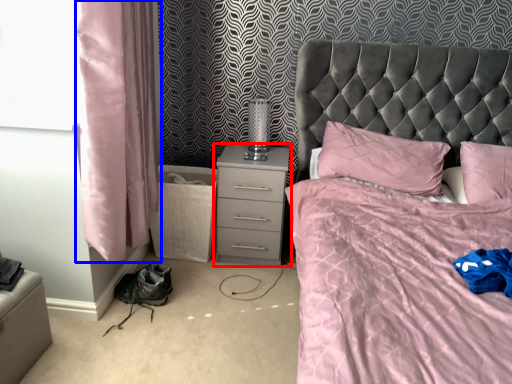
Question: Among these objects, which one is farthest to the camera, nightstand (highlighted by a red box) or curtain (highlighted by a blue box)?

Choices:
 (A) nightstand
 (B) curtain

Answer: (A)